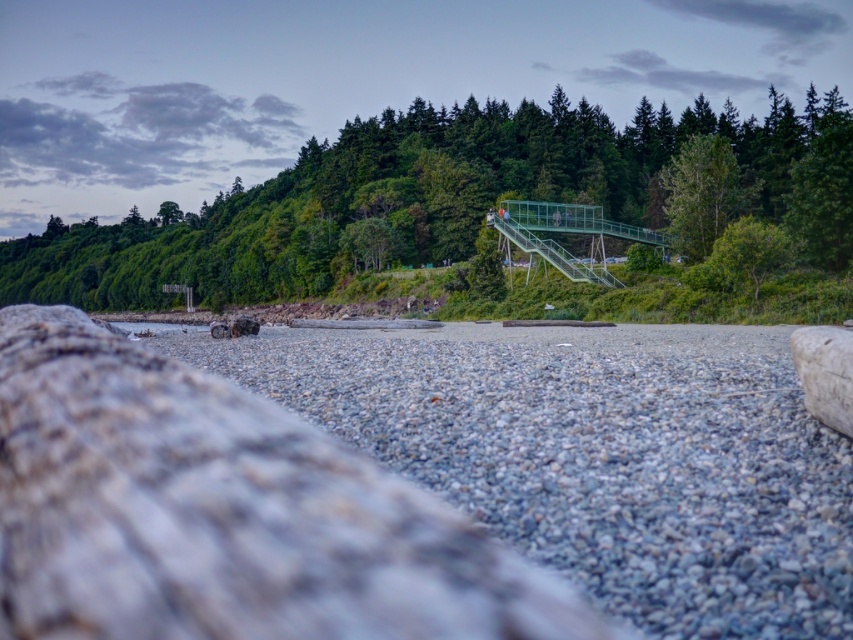
Consider the image. Measure the distance between gray rough wood at center and green metallic bridge at upper center.

The distance of gray rough wood at center from green metallic bridge at upper center is 107.69 meters.

Between point (20, 515) and point (825, 257), which one is positioned in front?

Point (20, 515) is more forward.

The image size is (853, 640). What are the coordinates of `gray rough wood at center` in the screenshot? It's located at (223, 513).

Is gray rough wood at center taller than green leafy tree at upper center?

Incorrect, gray rough wood at center's height is not larger of green leafy tree at upper center's.

Does gray rough wood at center have a smaller size compared to green leafy tree at upper center?

Indeed, gray rough wood at center has a smaller size compared to green leafy tree at upper center.

Does point (380, 605) lie behind point (672, 176)?

No, it is in front of (672, 176).

Identify the location of gray rough wood at center. Image resolution: width=853 pixels, height=640 pixels. (223, 513).

Who is higher up, green metallic bridge at upper center or green leafy tree at upper center?

green metallic bridge at upper center

Does point (804, 195) come in front of point (688, 236)?

Yes, point (804, 195) is closer to viewer.

Identify the location of green metallic bridge at upper center. (445, 196).

Where is `green metallic bridge at upper center`? The width and height of the screenshot is (853, 640). green metallic bridge at upper center is located at coordinates (445, 196).